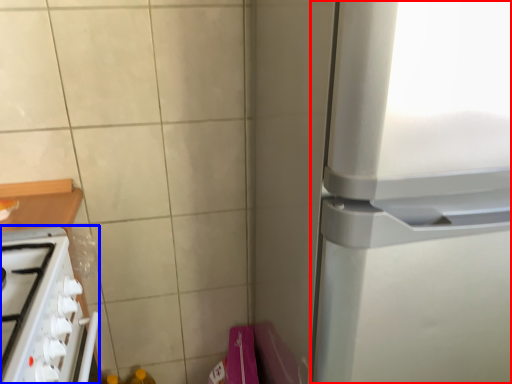
Question: Which object appears farthest to the camera in this image, refrigerator (highlighted by a red box) or home appliance (highlighted by a blue box)?

Choices:
 (A) refrigerator
 (B) home appliance

Answer: (B)